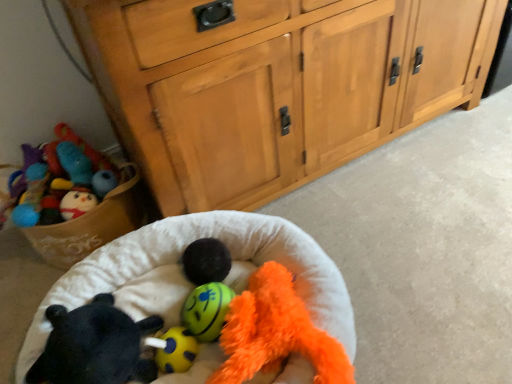
Identify the location of vacant space to the right of soft plush infant bed at center. (404, 255).